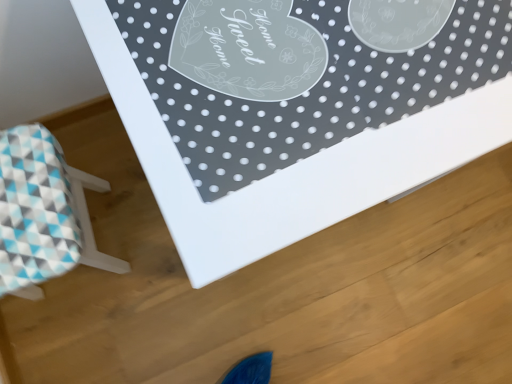
Locate an element on the screen. Image resolution: width=512 pixels, height=384 pixels. vacant area that lies between white glossy table at upper center and blue checkered stool at lower left is located at coordinates (137, 237).